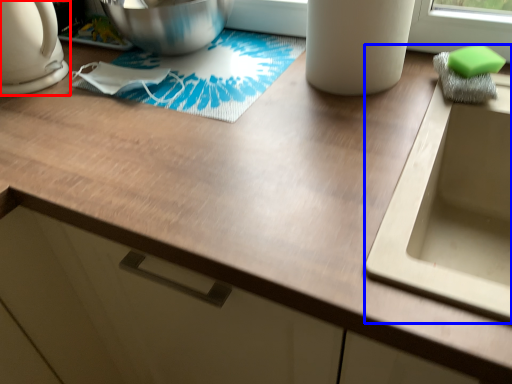
Question: Among these objects, which one is farthest to the camera, kitchen appliance (highlighted by a red box) or sink (highlighted by a blue box)?

Choices:
 (A) kitchen appliance
 (B) sink

Answer: (A)